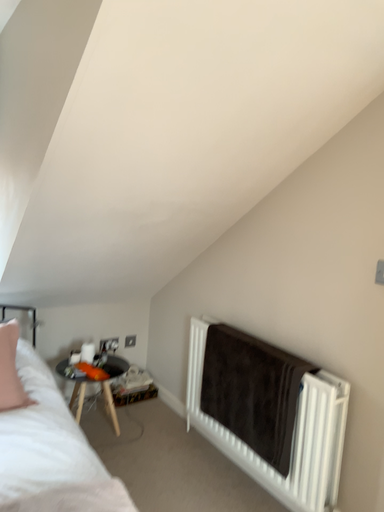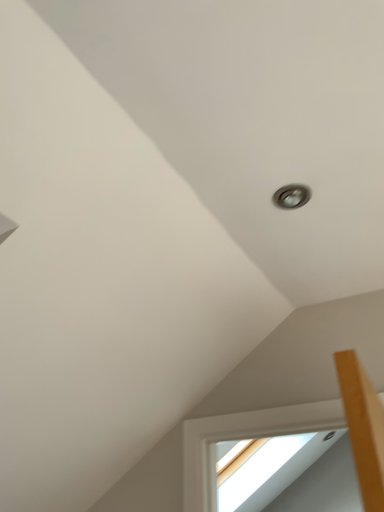
Question: How did the camera likely rotate when shooting the video?

Choices:
 (A) rotated upward
 (B) rotated downward

Answer: (A)